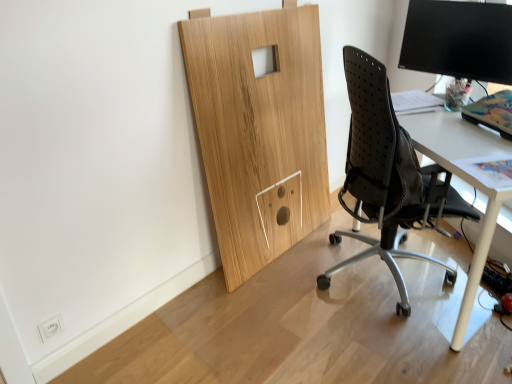
In order to click on free area in between black mesh chair at right and white glossy desk at right in this screenshot , I will do `click(376, 326)`.